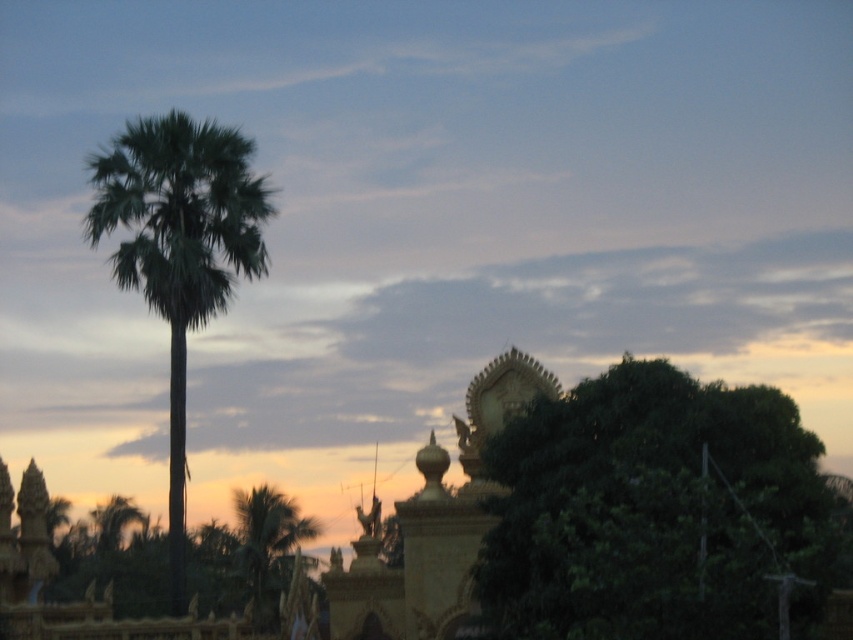
Question: Which of the following is the farthest from the observer?

Choices:
 (A) (511, 493)
 (B) (242, 147)
 (C) (265, 518)

Answer: (C)

Question: Which object appears closest to the camera in this image?

Choices:
 (A) green leafy tree at lower right
 (B) green leafy palm at left

Answer: (A)

Question: Observing the image, what is the correct spatial positioning of green leafy tree at lower right in reference to green leafy palm tree at lower left?

Choices:
 (A) below
 (B) above

Answer: (B)

Question: Which of these objects is positioned farthest from the green leafy palm tree at lower left?

Choices:
 (A) green leafy palm at left
 (B) green leafy tree at lower right

Answer: (B)

Question: Is green leafy tree at lower right above green leafy palm tree at lower left?

Choices:
 (A) no
 (B) yes

Answer: (B)

Question: From the image, what is the correct spatial relationship of green leafy tree at lower right in relation to green leafy palm at left?

Choices:
 (A) above
 (B) below

Answer: (B)